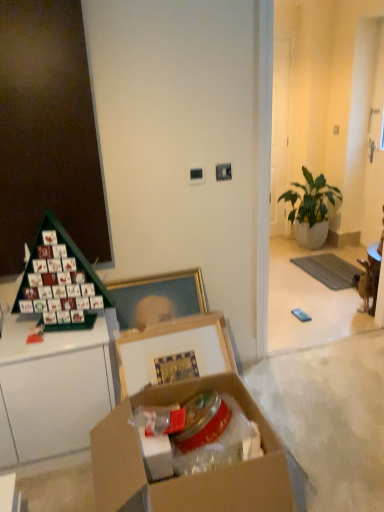
What are the coordinates of `green leafy plant in white pot at right` in the screenshot? It's located at (311, 209).

What do you see at coordinates (311, 209) in the screenshot? The width and height of the screenshot is (384, 512). I see `green leafy plant in white pot at right` at bounding box center [311, 209].

What is the approximate width of green leafy plant in white pot at right?

18.14 inches.

Measure the distance between point (x=327, y=190) and camera.

Point (x=327, y=190) is 4.18 meters from camera.

Locate an element on the screen. The image size is (384, 512). cardboard box at center is located at coordinates [x=187, y=476].

Describe the element at coordinates (187, 476) in the screenshot. This screenshot has height=512, width=384. I see `cardboard box at center` at that location.

Locate an element on the screen. The image size is (384, 512). green leafy plant in white pot at right is located at coordinates (311, 209).

Visually, is green leafy plant in white pot at right positioned to the left or to the right of cardboard box at center?

Based on their positions, green leafy plant in white pot at right is located to the right of cardboard box at center.

Is green leafy plant in white pot at right closer to camera compared to cardboard box at center?

No, the depth of green leafy plant in white pot at right is greater than that of cardboard box at center.

Is point (302, 241) closer or farther from the camera than point (289, 511)?

Clearly, point (302, 241) is more distant from the camera than point (289, 511).

From the image's perspective, relative to cardboard box at center, is green leafy plant in white pot at right above or below?

From the image's perspective, green leafy plant in white pot at right appears above cardboard box at center.

From a real-world perspective, between green leafy plant in white pot at right and cardboard box at center, who is vertically lower?

cardboard box at center, from a real-world perspective.

Is green leafy plant in white pot at right wider than cardboard box at center?

In fact, green leafy plant in white pot at right might be narrower than cardboard box at center.

Does green leafy plant in white pot at right have a greater height compared to cardboard box at center?

Yes.

Is green leafy plant in white pot at right smaller than cardboard box at center?

Incorrect, green leafy plant in white pot at right is not smaller in size than cardboard box at center.

Based on the photo, is green leafy plant in white pot at right spatially inside cardboard box at center, or outside of it?

green leafy plant in white pot at right is not inside cardboard box at center, it's outside.

Is green leafy plant in white pot at right next to cardboard box at center and touching it?

No, green leafy plant in white pot at right is not with cardboard box at center.

Is green leafy plant in white pot at right oriented away from cardboard box at center?

green leafy plant in white pot at right does not have its back to cardboard box at center.

What's the angular difference between green leafy plant in white pot at right and cardboard box at center's facing directions?

The angle between the facing direction of green leafy plant in white pot at right and the facing direction of cardboard box at center is 90.2 degrees.

What are the coordinates of `box located on the left of green leafy plant in white pot at right` in the screenshot? It's located at (187, 476).

Is cardboard box at center at the left side of green leafy plant in white pot at right?

Yes.

Considering their positions, is cardboard box at center located in front of or behind green leafy plant in white pot at right?

cardboard box at center is positioned closer to the viewer than green leafy plant in white pot at right.

Which is farther from the camera, (152, 499) or (309, 186)?

The point (309, 186) is farther from the camera.

From the image's perspective, between cardboard box at center and green leafy plant in white pot at right, which one is located above?

A: green leafy plant in white pot at right, from the image's perspective.

From a real-world perspective, which is physically below, cardboard box at center or green leafy plant in white pot at right?

cardboard box at center, from a real-world perspective.

Which object is wider, cardboard box at center or green leafy plant in white pot at right?

cardboard box at center.

Is cardboard box at center taller or shorter than green leafy plant in white pot at right?

Clearly, cardboard box at center is shorter compared to green leafy plant in white pot at right.

Which of these two, cardboard box at center or green leafy plant in white pot at right, is bigger?

green leafy plant in white pot at right.

Is cardboard box at center positioned beyond the bounds of green leafy plant in white pot at right?

Absolutely, cardboard box at center is external to green leafy plant in white pot at right.

Is cardboard box at center in contact with green leafy plant in white pot at right?

cardboard box at center is not next to green leafy plant in white pot at right, and they're not touching.

Is cardboard box at center oriented towards green leafy plant in white pot at right?

No, cardboard box at center is not facing towards green leafy plant in white pot at right.

Can you tell me how much cardboard box at center and green leafy plant in white pot at right differ in facing direction?

They differ by 90.2 degrees in their facing directions.

Where is `box in front of the green leafy plant in white pot at right`? The width and height of the screenshot is (384, 512). box in front of the green leafy plant in white pot at right is located at coordinates (187, 476).

Identify the location of box located in front of the green leafy plant in white pot at right. This screenshot has width=384, height=512. (187, 476).

What are the coordinates of `box on the left of green leafy plant in white pot at right` in the screenshot? It's located at click(187, 476).